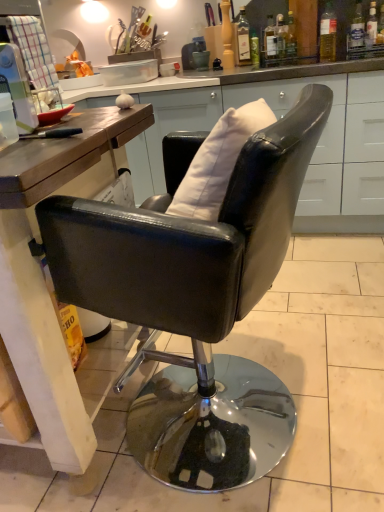
Where is `free spot in front of translucent glass bottle at upper right, the 5th bottle from the right`? The width and height of the screenshot is (384, 512). free spot in front of translucent glass bottle at upper right, the 5th bottle from the right is located at coordinates (288, 64).